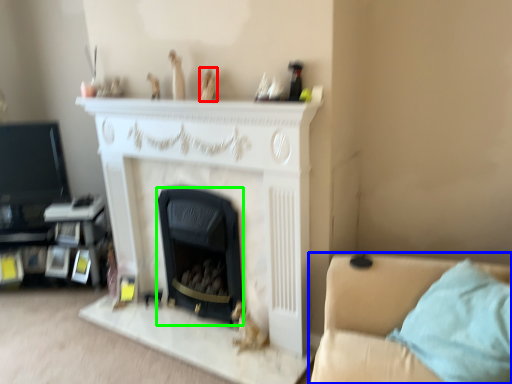
Question: Considering the real-world distances, which object is farthest from toy (highlighted by a red box)? studio couch (highlighted by a blue box) or fireplace (highlighted by a green box)?

Choices:
 (A) studio couch
 (B) fireplace

Answer: (A)